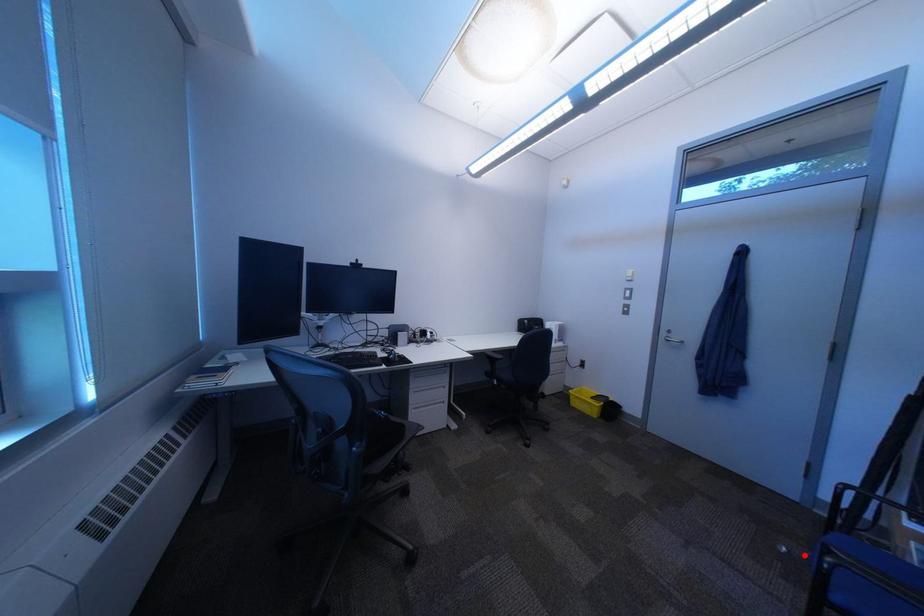
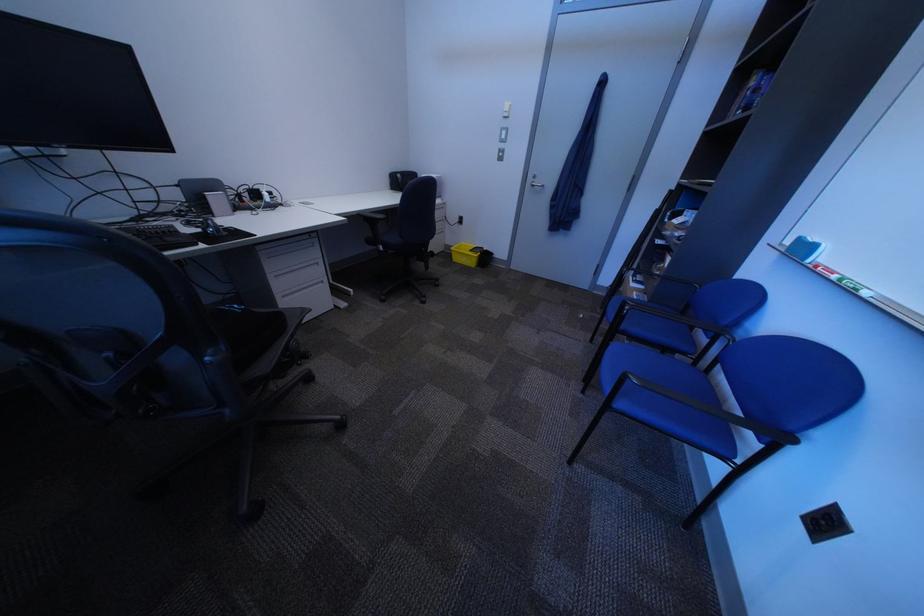
Where in the second image is the point corresponding to the highlighted location from the first image?

(599, 318)